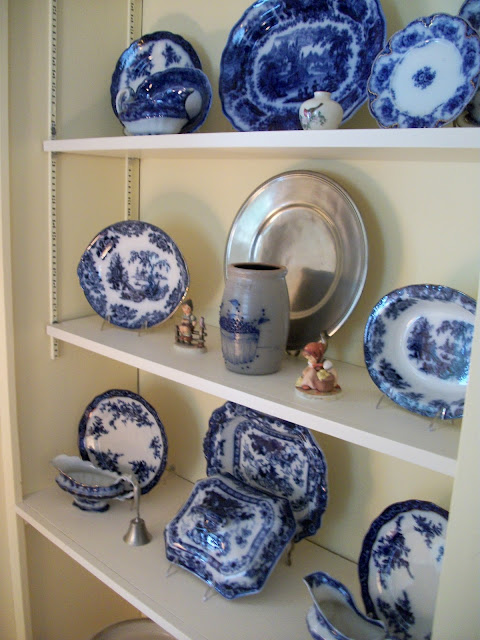
Identify the location of plate stand. (205, 595), (167, 572), (287, 561).